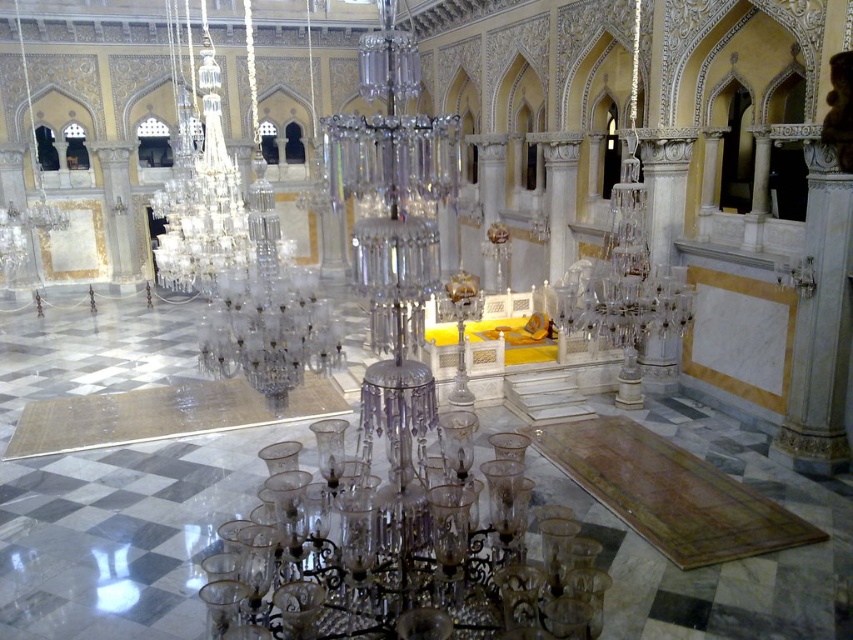
Question: Among these objects, which one is nearest to the camera?

Choices:
 (A) clear crystal chandelier at upper center
 (B) clear glass candle holder at center

Answer: (B)

Question: Can you confirm if clear crystal chandelier at upper center is positioned to the right of white marble column at center-right?

Choices:
 (A) yes
 (B) no

Answer: (B)

Question: Can you confirm if clear crystal chandelier at upper center is positioned above white marble column at center-right?

Choices:
 (A) no
 (B) yes

Answer: (B)

Question: Does clear glass candle holder at center appear over clear crystal chandelier at upper center?

Choices:
 (A) yes
 (B) no

Answer: (B)

Question: Which of the following is the closest to the observer?

Choices:
 (A) (677, 353)
 (B) (537, 604)

Answer: (B)

Question: Which of the following is the farthest from the observer?

Choices:
 (A) clear crystal chandelier at upper center
 (B) clear glass candle holder at center
 (C) white marble column at center-right

Answer: (C)